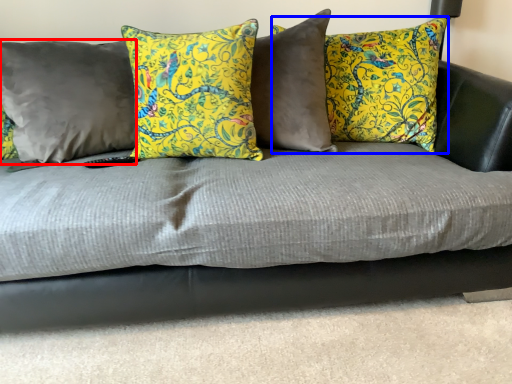
Question: Among these objects, which one is nearest to the camera, pillow (highlighted by a red box) or pillow (highlighted by a blue box)?

Choices:
 (A) pillow
 (B) pillow

Answer: (A)